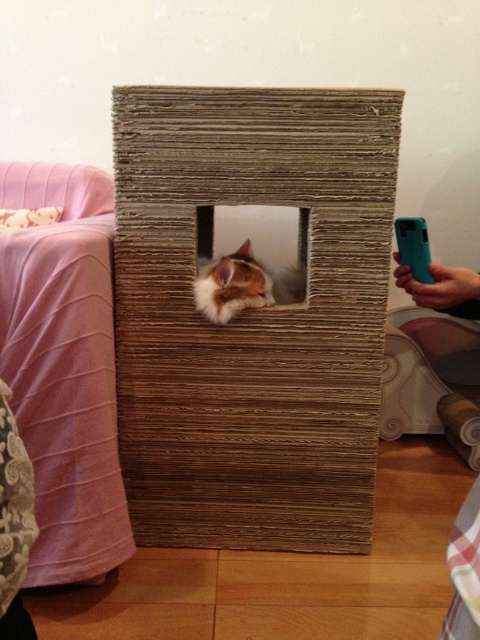
Question: Which point is closer to the camera?

Choices:
 (A) (295, 282)
 (B) (477, 636)
 (C) (155, 442)

Answer: (B)

Question: Can you confirm if brown cardboard box at center is bigger than fluffy orange cat at center?

Choices:
 (A) no
 (B) yes

Answer: (B)

Question: Observing the image, what is the correct spatial positioning of brown cardboard box at center in reference to fluffy orange cat at center?

Choices:
 (A) below
 (B) above

Answer: (A)

Question: Which of the following is the closest to the observer?

Choices:
 (A) fluffy orange cat at center
 (B) brown cardboard box at center

Answer: (B)

Question: Is brown cardboard box at center positioned before teal plastic phone at lower right?

Choices:
 (A) yes
 (B) no

Answer: (B)

Question: Estimate the real-world distances between objects in this image. Which object is farther from the teal plastic phone at lower right?

Choices:
 (A) fluffy orange cat at center
 (B) brown cardboard box at center

Answer: (B)